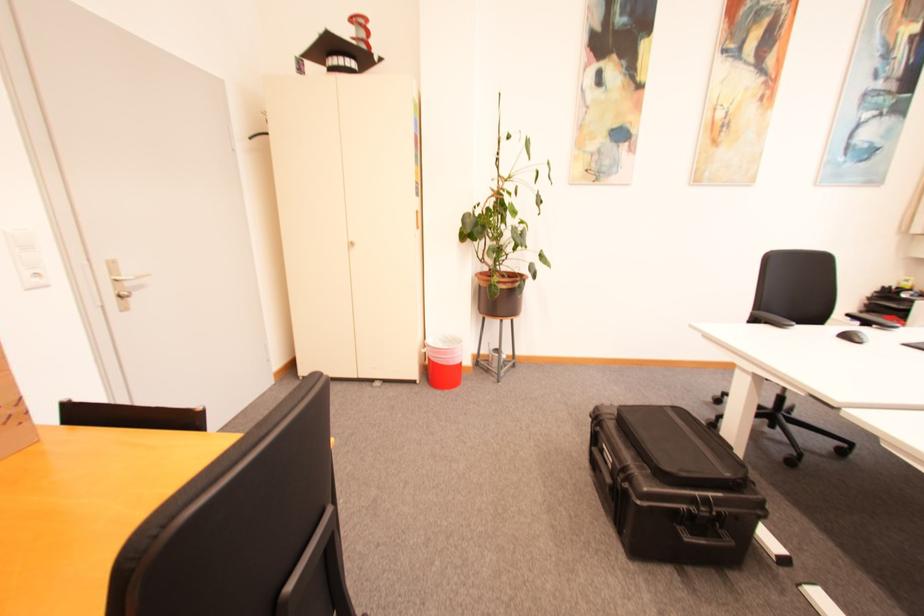
The location [444,361] corresponds to which object?

It refers to a red trash can.